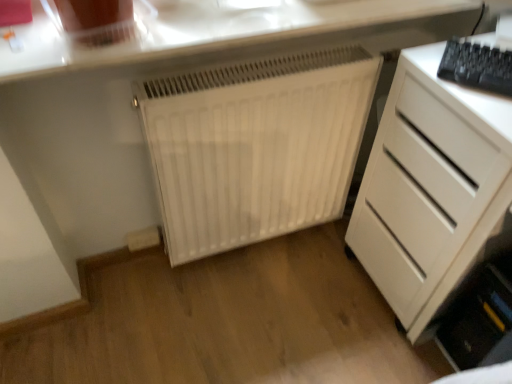
Question: Considering their positions, is white matte radiator at center located in front of or behind white glossy countertop at upper center?

Choices:
 (A) front
 (B) behind

Answer: (B)

Question: From a real-world perspective, is white matte radiator at center physically located above or below white glossy countertop at upper center?

Choices:
 (A) above
 (B) below

Answer: (B)

Question: Estimate the real-world distances between objects in this image. Which object is farther from the white matte radiator at center?

Choices:
 (A) white glossy countertop at upper center
 (B) black plastic keyboard at upper right
 (C) white matte chest of drawers at right

Answer: (B)

Question: Which object is positioned closest to the black plastic keyboard at upper right?

Choices:
 (A) white matte radiator at center
 (B) white matte chest of drawers at right
 (C) white glossy countertop at upper center

Answer: (B)